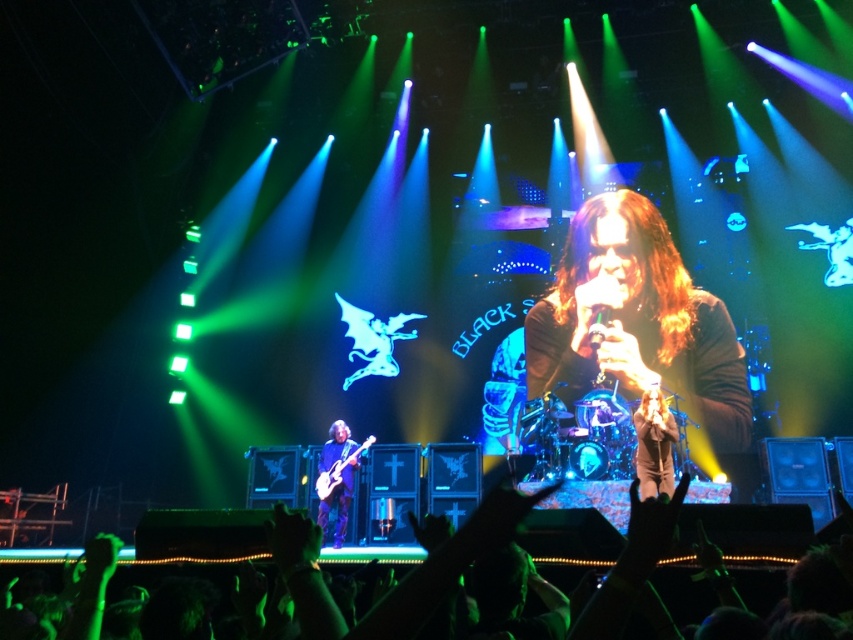
Question: Is shiny brown hair at center wider than shiny metallic guitar at lower center?

Choices:
 (A) yes
 (B) no

Answer: (A)

Question: Considering the relative positions of shiny brown guitar at lower left and shiny metallic guitar at lower center in the image provided, where is shiny brown guitar at lower left located with respect to shiny metallic guitar at lower center?

Choices:
 (A) right
 (B) left

Answer: (B)

Question: Which point appears closest to the camera in this image?

Choices:
 (A) (357, 461)
 (B) (335, 472)
 (C) (677, 260)

Answer: (C)

Question: Is shiny brown hair at center closer to camera compared to shiny brown guitar at lower left?

Choices:
 (A) yes
 (B) no

Answer: (A)

Question: Which point appears closest to the camera in this image?

Choices:
 (A) (550, 369)
 (B) (323, 504)

Answer: (A)

Question: Among these objects, which one is nearest to the camera?

Choices:
 (A) shiny brown guitar at lower left
 (B) shiny metallic guitar at lower center

Answer: (A)